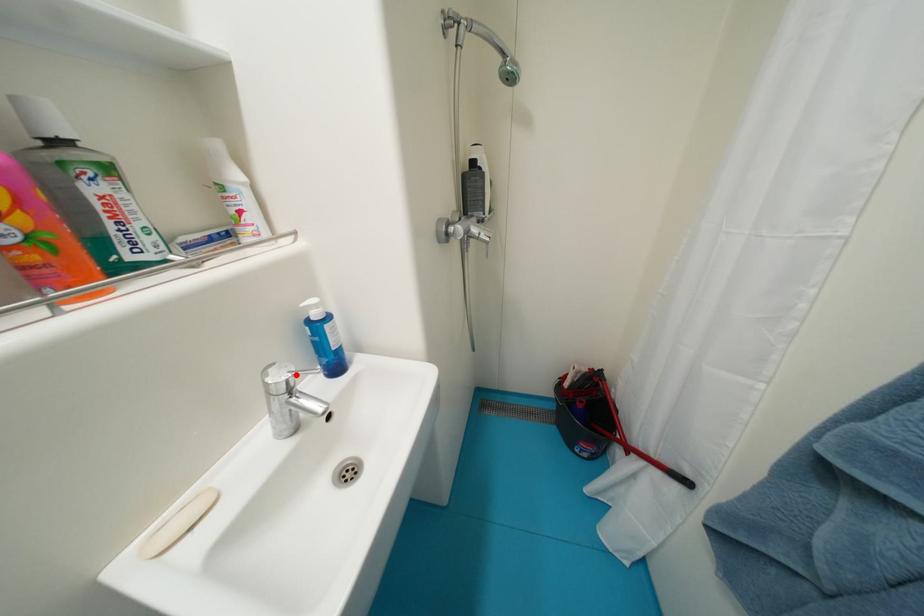
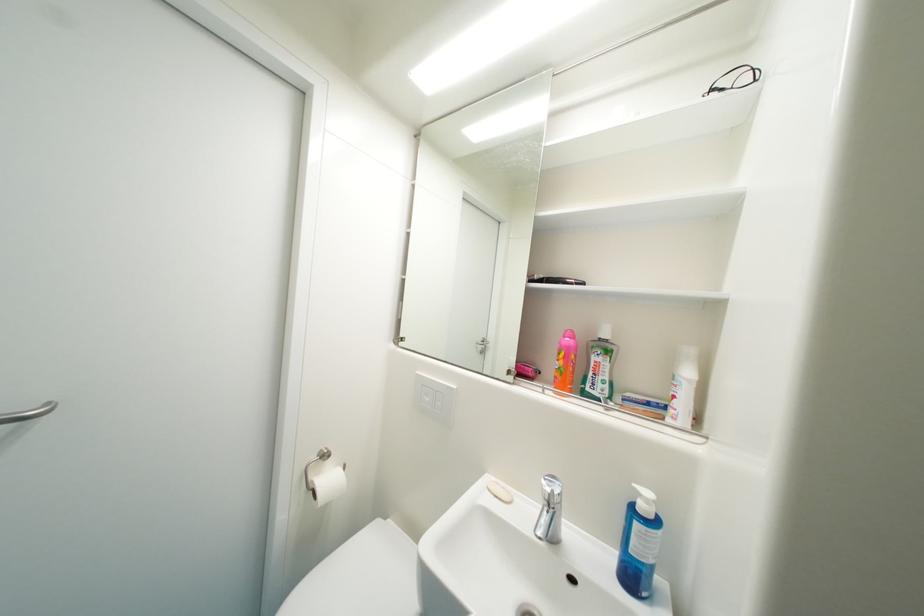
Question: I am providing you with two images of the same scene from different viewpoints. In image1, a red point is highlighted. Considering the same 3D point in image2, which of the following is correct?

Choices:
 (A) It is closer
 (B) It is farther

Answer: (B)